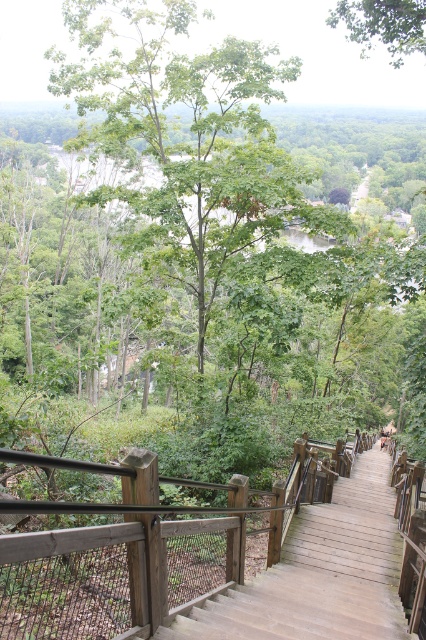
Question: Does green leafy tree at center appear on the right side of green leafy tree at upper center?

Choices:
 (A) yes
 (B) no

Answer: (B)

Question: Is wooden stairs at center above green leafy tree at upper center?

Choices:
 (A) no
 (B) yes

Answer: (A)

Question: Which of the following is the farthest from the observer?

Choices:
 (A) green leafy tree at upper center
 (B) green leafy tree at center

Answer: (A)

Question: Can you confirm if wooden stairs at center is positioned to the left of green leafy tree at upper center?

Choices:
 (A) yes
 (B) no

Answer: (A)

Question: Among these points, which one is nearest to the camera?

Choices:
 (A) (270, 572)
 (B) (419, 28)

Answer: (A)

Question: Which of these objects is positioned closest to the green leafy tree at center?

Choices:
 (A) green leafy tree at upper center
 (B) wooden stairs at center

Answer: (A)